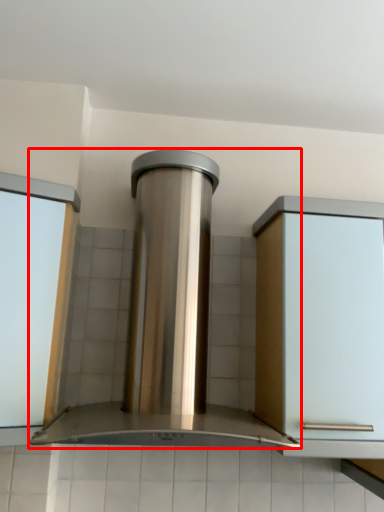
Question: From the image, what is the correct spatial relationship of home appliance (annotated by the red box) in relation to window frame?

Choices:
 (A) left
 (B) right

Answer: (B)